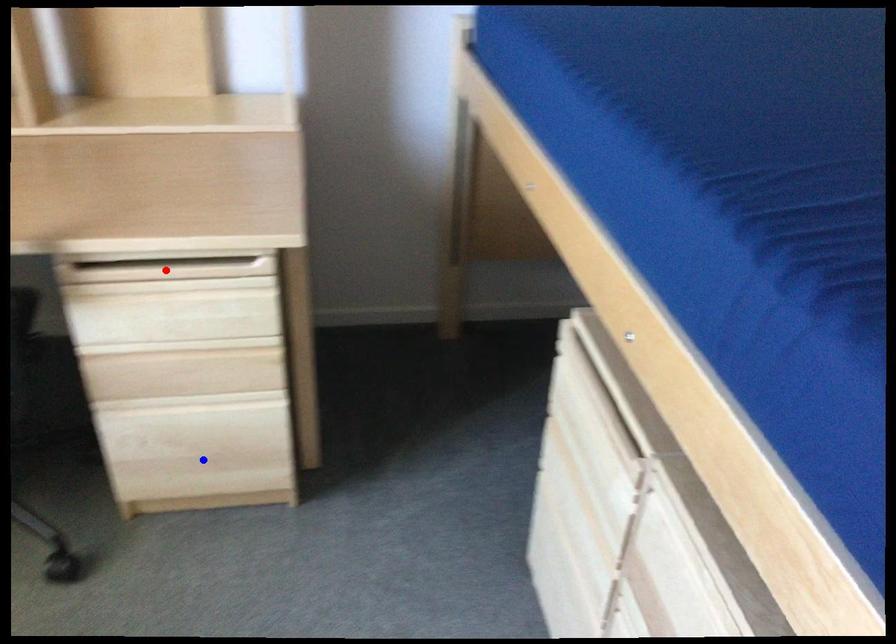
Question: In the image, two points are highlighted. Which point is nearer to the camera? Reply with the corresponding letter.

Choices:
 (A) blue point
 (B) red point

Answer: (B)